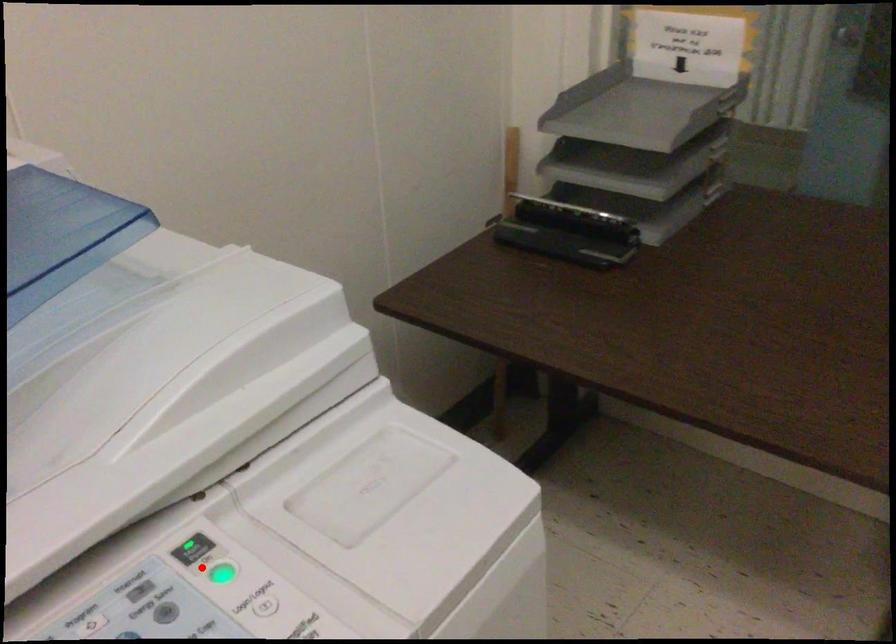
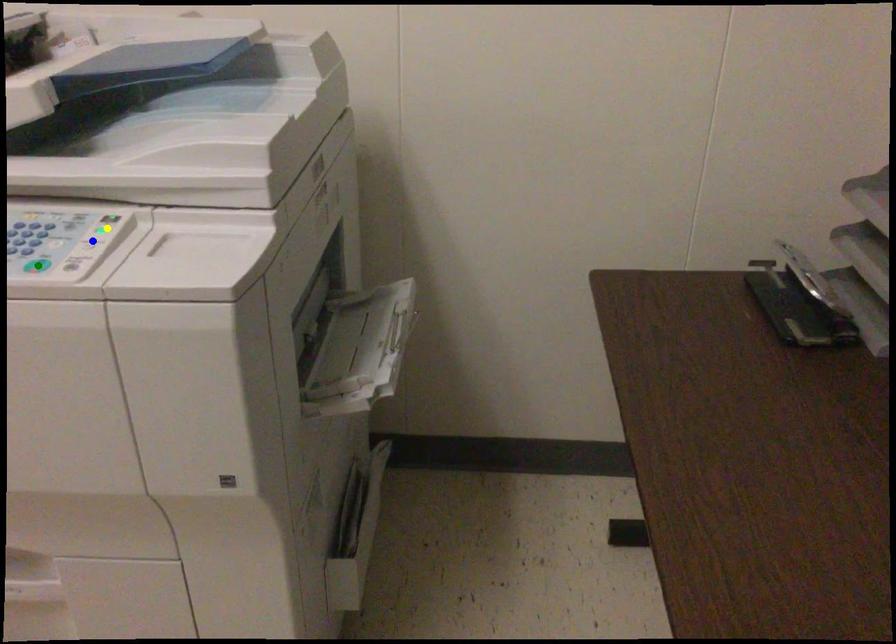
Question: I am providing you with two images of the same scene from different viewpoints. A red point is marked on the first image. You are given multiple points on the second image. Which spot in image 2 lines up with the point in image 1?

Choices:
 (A) yellow point
 (B) blue point
 (C) green point

Answer: (A)